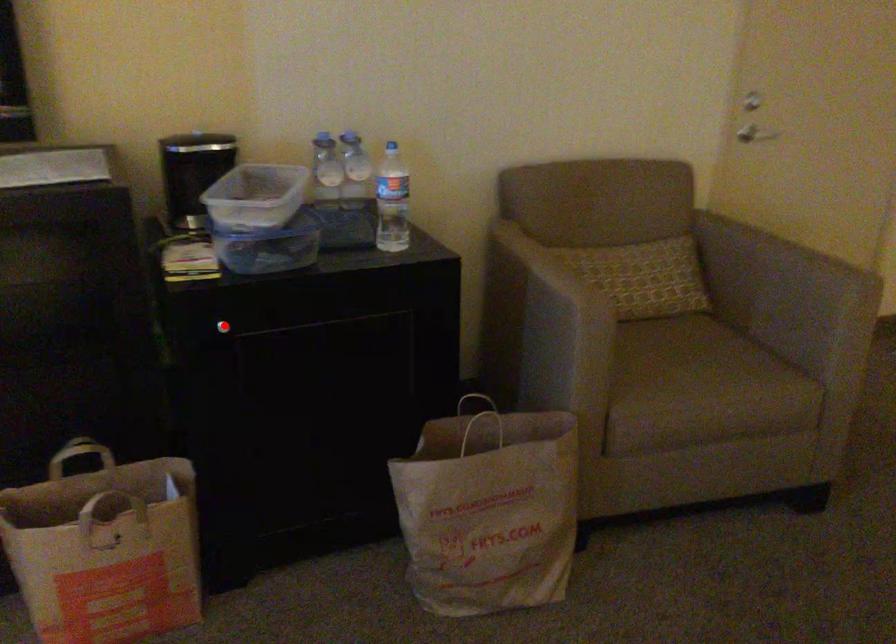
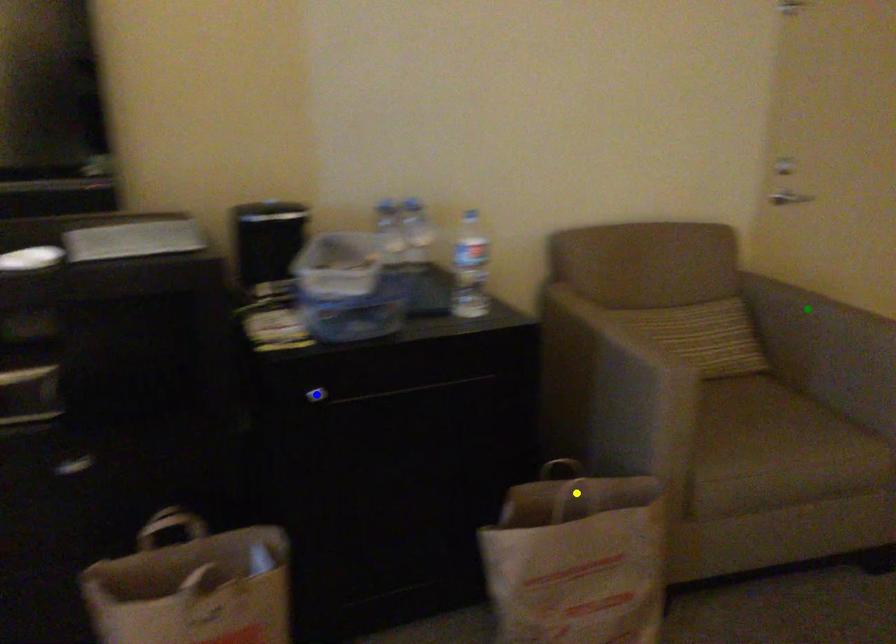
Question: I am providing you with two images of the same scene from different viewpoints. A red point is marked on the first image. You are given multiple points on the second image. Which mark in image 2 goes with the point in image 1?

Choices:
 (A) yellow point
 (B) green point
 (C) blue point

Answer: (C)